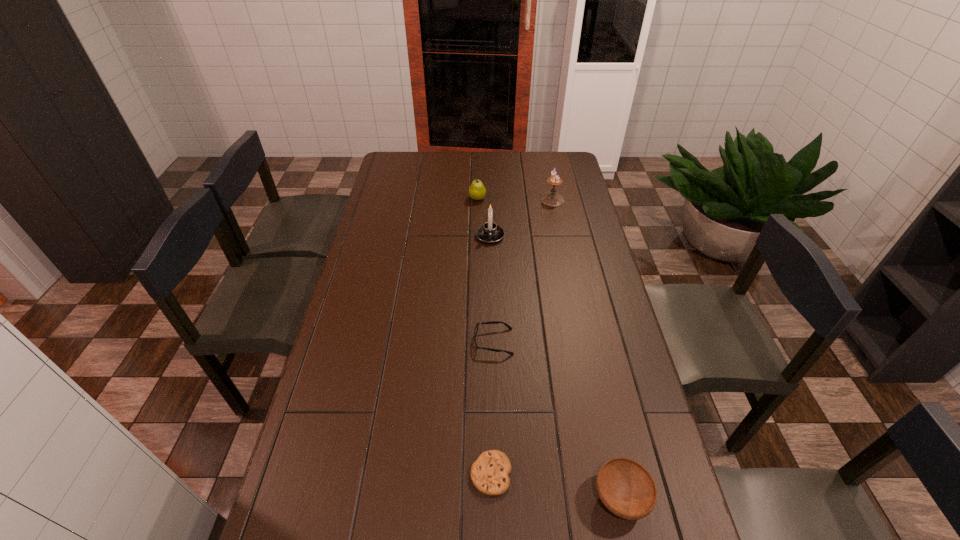
Where is `the farther candle holder`? the farther candle holder is located at coordinates (552, 199).

Find the location of a particular element. The image size is (960, 540). the third farthest object is located at coordinates (490, 232).

Identify the location of the left candle holder. This screenshot has height=540, width=960. (490, 232).

Locate an element on the screen. pear is located at coordinates (477, 191).

The image size is (960, 540). In order to click on bowl in this screenshot , I will do `click(626, 488)`.

What are the coordinates of `spectacles` in the screenshot? It's located at (492, 322).

The width and height of the screenshot is (960, 540). Find the location of `the fifth tallest object`. the fifth tallest object is located at coordinates (492, 322).

Image resolution: width=960 pixels, height=540 pixels. What are the coordinates of `the shortest object` in the screenshot? It's located at (489, 473).

Identify the location of free space located on the front of the farther candle holder. (559, 230).

Where is `vacant area located 0.280m with a handle on the side of the nearer candle holder`? vacant area located 0.280m with a handle on the side of the nearer candle holder is located at coordinates (492, 297).